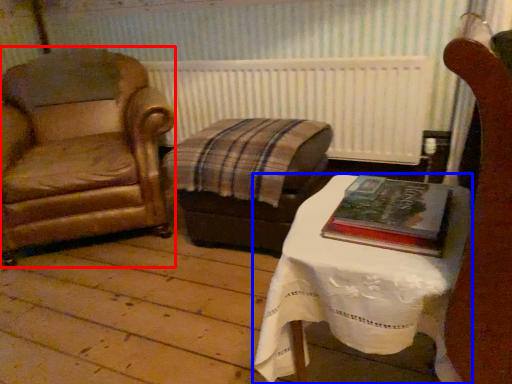
Question: Which point is further to the camera, chair (highlighted by a red box) or table (highlighted by a blue box)?

Choices:
 (A) chair
 (B) table

Answer: (A)